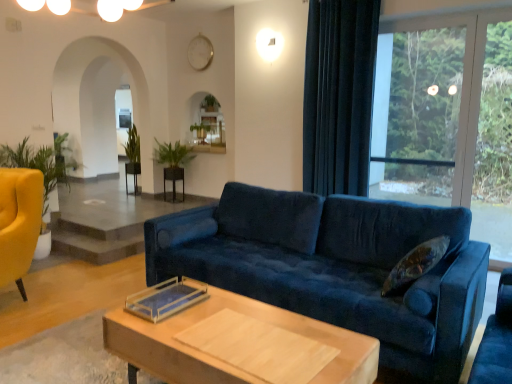
Question: In terms of size, does black glossy side table at center, which is the second side table from right to left, appear bigger or smaller than velvet dark blue curtain at right?

Choices:
 (A) big
 (B) small

Answer: (B)

Question: Is black glossy side table at center, which is the 2th side table from front to back, taller or shorter than velvet dark blue curtain at right?

Choices:
 (A) tall
 (B) short

Answer: (B)

Question: Estimate the real-world distances between objects in this image. Which object is closer to the light wood/wooden coffee table at center?

Choices:
 (A) velvet dark blue curtain at right
 (B) matte yellow armchair at left
 (C) black wood side table at center, which is counted as the 2th side table, starting from the left
 (D) black glossy side table at center, the first side table when ordered from left to right
 (E) transparent glass window at upper right

Answer: (B)

Question: Based on their relative distances, which object is farther from the black glossy side table at center, which is the 2th side table from front to back?

Choices:
 (A) green leafy plant at center, the second plant viewed from the right
 (B) velvet blue couch at center
 (C) transparent glass window at upper right
 (D) black wood side table at center, the 2th side table when ordered from back to front
 (E) velvet dark blue curtain at right

Answer: (B)